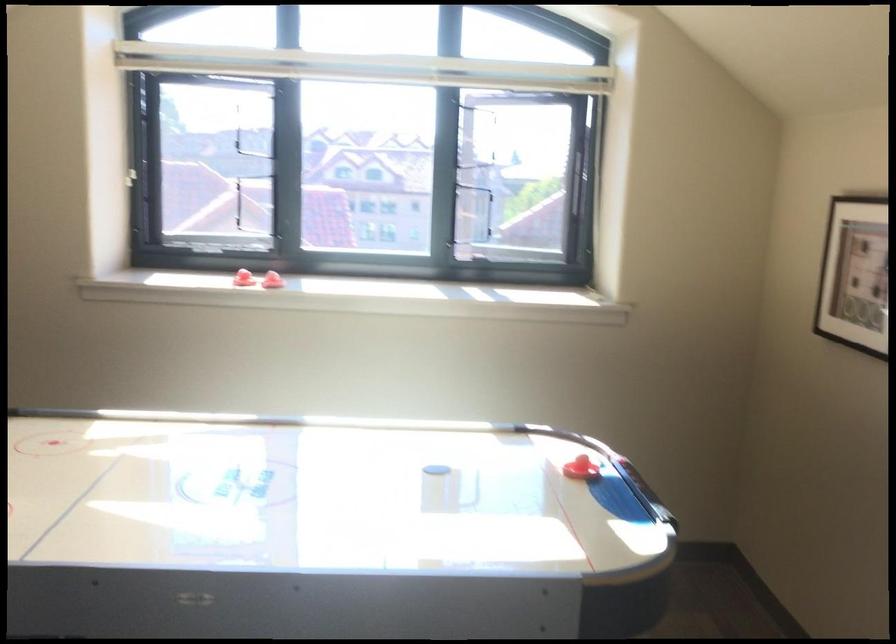
Which object does [442,467] point to?

It refers to a black air hockey puck.